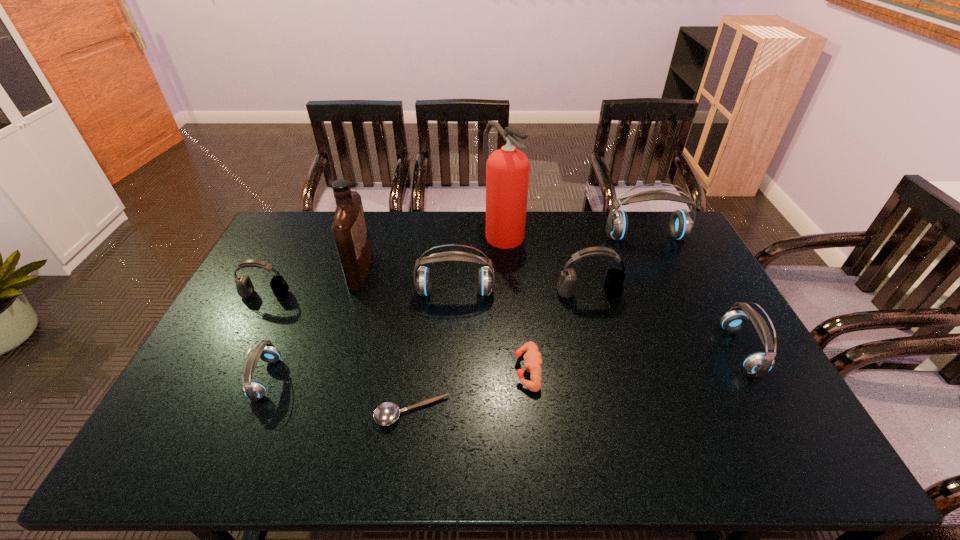
You are a GUI agent. You are given a task and a screenshot of the screen. Output one action in this format:
    pyautogui.click(x=<x>, y=<y>)
    Task: Click on the free space that satisfies the following two spatial constraints: 1. on the label side of the ninth shortest object; 2. on the left side of the shortest object
    
    Given the screenshot: What is the action you would take?
    pyautogui.click(x=317, y=412)

At what (x,y) coordinates should I click in order to perform the action: click on free space in the image that satisfies the following two spatial constraints: 1. with the gloves of the second shortest object facing forward; 2. on the front side of the ladle. Please return your answer as a coordinate pair (x, y). Looking at the image, I should click on (532, 412).

This screenshot has width=960, height=540. What are the coordinates of `vacant area that satisfies the following two spatial constraints: 1. on the headband of the third object from right to left; 2. on the ear cups of the second headset from left to right` in the screenshot? It's located at (611, 379).

This screenshot has height=540, width=960. I want to click on free space that satisfies the following two spatial constraints: 1. on the handle side of the red fire extinguisher; 2. on the label side of the liquor, so click(x=506, y=271).

Image resolution: width=960 pixels, height=540 pixels. In order to click on vacant region that satisfies the following two spatial constraints: 1. on the headband of the third object from right to left; 2. with the gloves of the red puncher facing forward in this screenshot , I will do `click(609, 370)`.